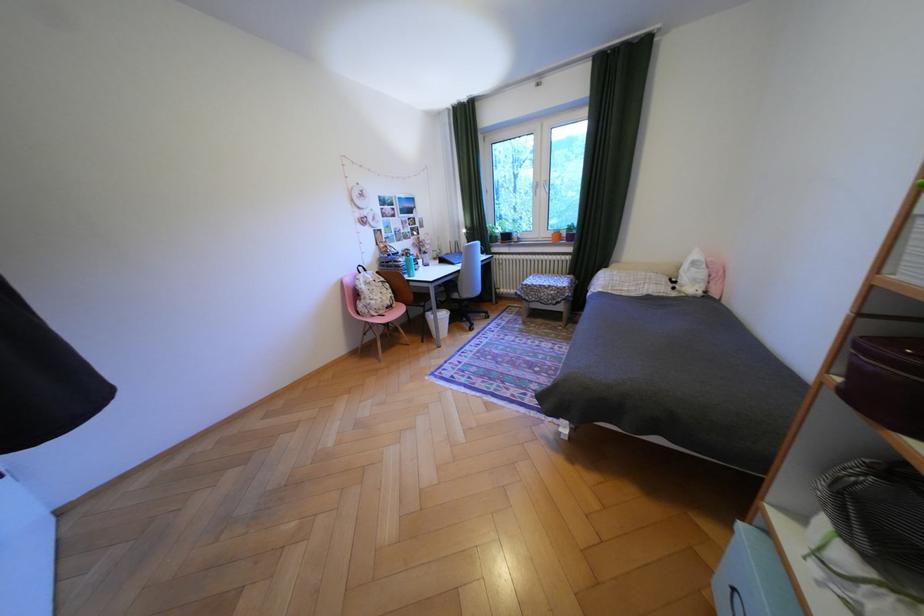
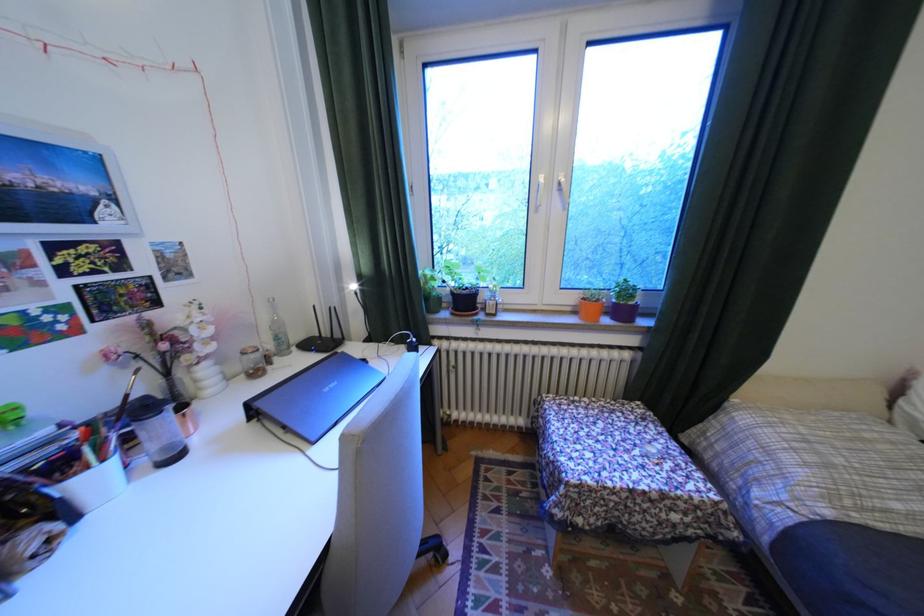
The point at (x=507, y=237) is marked in the first image. Where is the corresponding point in the second image?

(451, 299)